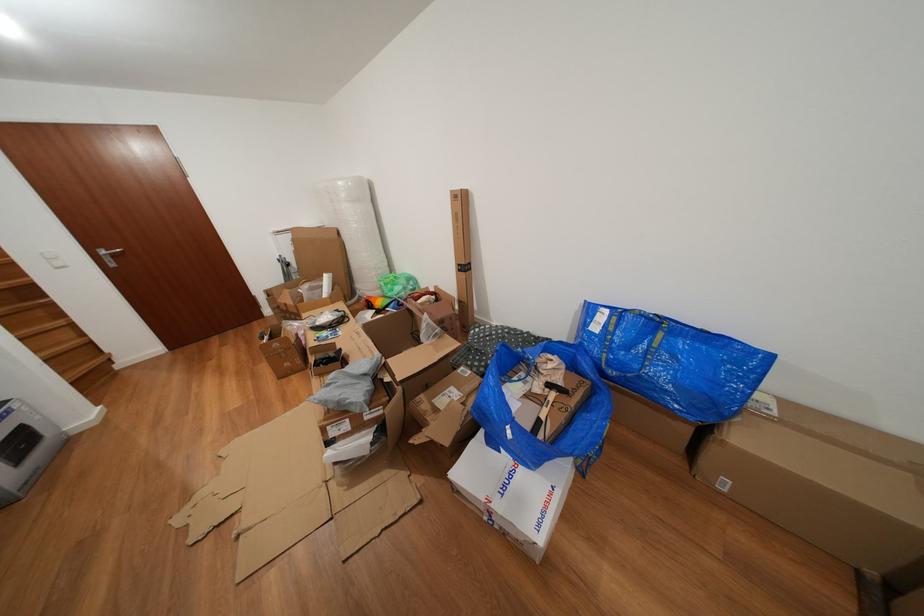
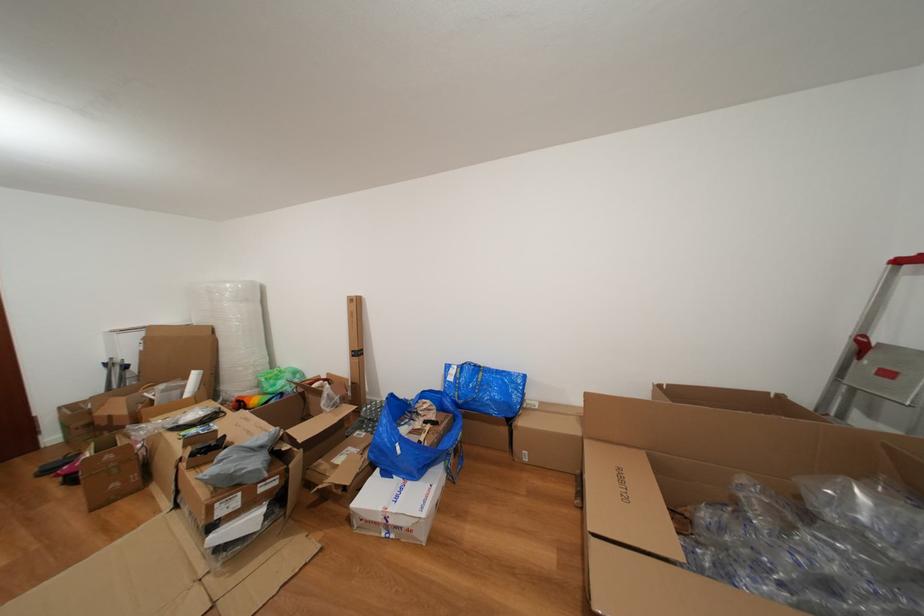
The point at (x=399, y=294) is marked in the first image. Where is the corresponding point in the second image?

(283, 390)